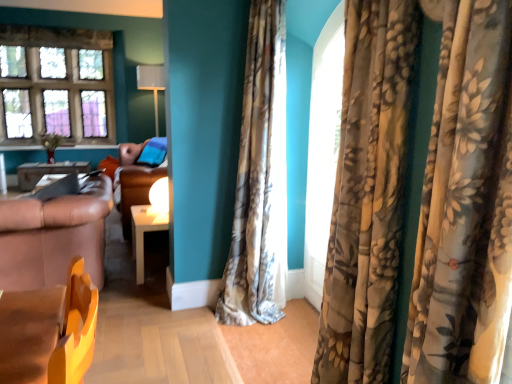
In order to face brown leather couch at left, should I rotate leftwards or rightwards?

To align with it, rotate left about 26.096°.

Describe the element at coordinates (56, 85) in the screenshot. I see `stained glass window at upper left` at that location.

Image resolution: width=512 pixels, height=384 pixels. I want to click on floral velvet curtains at right, placed as the second curtain when sorted from back to front, so click(465, 203).

The height and width of the screenshot is (384, 512). What do you see at coordinates (151, 85) in the screenshot?
I see `white glossy lampshade at upper center` at bounding box center [151, 85].

Find the location of a particular element. The width and height of the screenshot is (512, 384). brown leather couch at center is located at coordinates (137, 176).

From a real-world perspective, is brown leather couch at left positioned over white glossy lampshade at upper center based on gravity?

No, from a real-world perspective, brown leather couch at left is not above white glossy lampshade at upper center.

Measure the distance between brown leather couch at left and white glossy lampshade at upper center.

brown leather couch at left and white glossy lampshade at upper center are 3.46 meters apart from each other.

Which is more to the right, brown leather couch at left or white glossy lampshade at upper center?

Positioned to the right is brown leather couch at left.

What's the angular difference between brown leather couch at left and white glossy lampshade at upper center's facing directions?

The angular difference between brown leather couch at left and white glossy lampshade at upper center is 176 degrees.

How far apart are metallic silver table at left, acting as the first table starting from the top, and floral velvet curtains at right, the second curtain viewed from the left?

They are 13.28 feet apart.

Does metallic silver table at left, the 2th table positioned from the right, appear on the left side of floral velvet curtains at right, the first curtain positioned from the right?

Correct, you'll find metallic silver table at left, the 2th table positioned from the right, to the left of floral velvet curtains at right, the first curtain positioned from the right.

From a real-world perspective, who is located lower, metallic silver table at left, which ranks as the first table in left-to-right order, or floral velvet curtains at right, placed as the second curtain when sorted from back to front?

metallic silver table at left, which ranks as the first table in left-to-right order, from a real-world perspective.

Is point (28, 184) closer to camera compared to point (339, 171)?

That is False.

Is there a large distance between white glossy table at center, the first table positioned from the right, and brown leather couch at left?

No, white glossy table at center, the first table positioned from the right, is not far away from brown leather couch at left.

Is white glossy table at center, which is counted as the second table, starting from the back, closer to camera compared to brown leather couch at left?

No, white glossy table at center, which is counted as the second table, starting from the back, is further to the viewer.

Based on the photo, considering the relative sizes of white glossy table at center, which is the first table from front to back, and brown leather couch at left in the image provided, is white glossy table at center, which is the first table from front to back, shorter than brown leather couch at left?

Yes.

Is point (165, 226) less distant than point (44, 221)?

No, (165, 226) is further to viewer.

Is brown leather couch at center oriented away from floral silk curtain at center, arranged as the 1th curtain when viewed from the back?

brown leather couch at center is not turned away from floral silk curtain at center, arranged as the 1th curtain when viewed from the back.

In terms of width, does brown leather couch at center look wider or thinner when compared to floral silk curtain at center, placed as the 2th curtain when sorted from front to back?

brown leather couch at center is wider than floral silk curtain at center, placed as the 2th curtain when sorted from front to back.

Can you confirm if brown leather couch at center is shorter than metallic silver table at left, the second table ordered from the bottom?

Incorrect, the height of brown leather couch at center does not fall short of that of metallic silver table at left, the second table ordered from the bottom.

Based on their positions, is brown leather couch at center located to the left or right of metallic silver table at left, the 2th table positioned from the right?

In the image, brown leather couch at center appears on the right side of metallic silver table at left, the 2th table positioned from the right.

From the picture: Which object is thinner, brown leather couch at center or metallic silver table at left, the 2th table positioned from the right?

Thinner between the two is metallic silver table at left, the 2th table positioned from the right.

From a real-world perspective, which is physically below, brown leather couch at center or metallic silver table at left, which is counted as the 1th table, starting from the back?

In real-world perspective, metallic silver table at left, which is counted as the 1th table, starting from the back, is lower.

Are stained glass window at upper left and brown leather couch at center beside each other?

No, stained glass window at upper left is not with brown leather couch at center.

Based on the photo, considering the relative positions of stained glass window at upper left and brown leather couch at center in the image provided, is stained glass window at upper left in front of brown leather couch at center?

No, stained glass window at upper left is behind brown leather couch at center.

How far apart are stained glass window at upper left and brown leather couch at center?

stained glass window at upper left is 1.89 meters from brown leather couch at center.

Is stained glass window at upper left at the left side of brown leather couch at center?

Indeed, stained glass window at upper left is positioned on the left side of brown leather couch at center.

From a real-world perspective, which is physically below, stained glass window at upper left or metallic silver table at left, which ranks as the first table in left-to-right order?

metallic silver table at left, which ranks as the first table in left-to-right order.

Considering the sizes of stained glass window at upper left and metallic silver table at left, the second table ordered from the bottom, in the image, is stained glass window at upper left taller or shorter than metallic silver table at left, the second table ordered from the bottom,?

In the image, stained glass window at upper left appears to be taller than metallic silver table at left, the second table ordered from the bottom.

I want to click on the 1st table in front when counting from the stained glass window at upper left, so click(47, 171).

Considering the relative positions of stained glass window at upper left and metallic silver table at left, the 2th table positioned from the right, in the image provided, is stained glass window at upper left to the left or to the right of metallic silver table at left, the 2th table positioned from the right,?

stained glass window at upper left is positioned on metallic silver table at left, the 2th table positioned from the right,'s left side.

Where is `studio couch below the white glossy lampshade at upper center (from the image's perspective)`? This screenshot has height=384, width=512. studio couch below the white glossy lampshade at upper center (from the image's perspective) is located at coordinates (54, 236).

From the metallic silver table at left, acting as the first table starting from the top, count 2nd curtains forward and point to it. Please provide its 2D coordinates.

[(465, 203)]

Based on their spatial positions, is brown leather couch at center or white glossy table at center, placed as the 2th table when sorted from top to bottom, closer to brown leather couch at left?

white glossy table at center, placed as the 2th table when sorted from top to bottom.

Based on their spatial positions, is floral fabric curtain at right or white glossy table at center, which is counted as the second table, starting from the back, further from floral silk curtain at center, placed as the 2th curtain when sorted from front to back?

Based on the image, white glossy table at center, which is counted as the second table, starting from the back, appears to be further to floral silk curtain at center, placed as the 2th curtain when sorted from front to back.

From the image, which object appears to be farther from stained glass window at upper left, floral velvet curtains at right, the first curtain positioned from the right, or white glossy lampshade at upper center?

Based on the image, floral velvet curtains at right, the first curtain positioned from the right, appears to be further to stained glass window at upper left.

Estimate the real-world distances between objects in this image. Which object is closer to metallic silver table at left, the 2th table positioned from the right, floral fabric curtain at right or brown leather couch at left?

brown leather couch at left is closer to metallic silver table at left, the 2th table positioned from the right.

Considering their positions, is metallic silver table at left, the 2th table positioned from the right, positioned further to brown leather couch at left than white glossy table at center, placed as the 2th table when sorted from top to bottom?

metallic silver table at left, the 2th table positioned from the right, lies further to brown leather couch at left than the other object.

Which object lies nearer to the anchor point brown leather couch at left, floral velvet curtains at right, the first curtain positioned from the right, or stained glass window at upper left?

floral velvet curtains at right, the first curtain positioned from the right, is closer to brown leather couch at left.

Consider the image. From the image, which object appears to be farther from stained glass window at upper left, metallic silver table at left, the 2th table positioned from the right, or floral fabric curtain at right?

floral fabric curtain at right.

Looking at the image, which one is located further to brown leather couch at center, brown leather couch at left or white glossy table at center, placed as the 2th table when sorted from top to bottom?

Based on the image, brown leather couch at left appears to be further to brown leather couch at center.

In order to click on couch positioned between floral fabric curtain at right and stained glass window at upper left from near to far in this screenshot , I will do `click(137, 176)`.

Find the location of a particular element. Image resolution: width=512 pixels, height=384 pixels. couch positioned between floral silk curtain at center, the 1th curtain positioned from the left, and white glossy lampshade at upper center from near to far is located at coordinates pos(137,176).

You are a GUI agent. You are given a task and a screenshot of the screen. Output one action in this format:
    pyautogui.click(x=<x>, y=<y>)
    Task: Click on the studio couch between floral fabric curtain at right and metallic silver table at left, the second table in the front-to-back sequence, along the z-axis
    The image size is (512, 384).
    Given the screenshot: What is the action you would take?
    tap(54, 236)

The width and height of the screenshot is (512, 384). What are the coordinates of `curtain positioned between floral velvet curtains at right, the first curtain positioned from the right, and brown leather couch at center from near to far` in the screenshot? It's located at (255, 179).